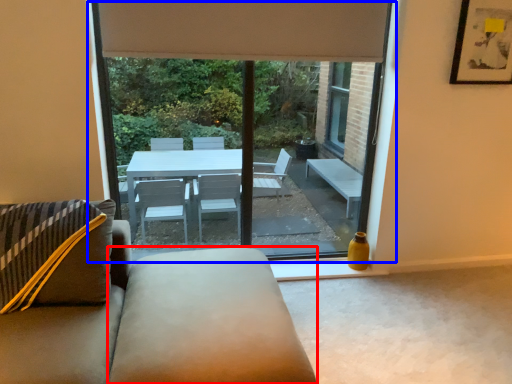
Question: Which object appears farthest to the camera in this image, flat (highlighted by a red box) or window (highlighted by a blue box)?

Choices:
 (A) flat
 (B) window

Answer: (B)